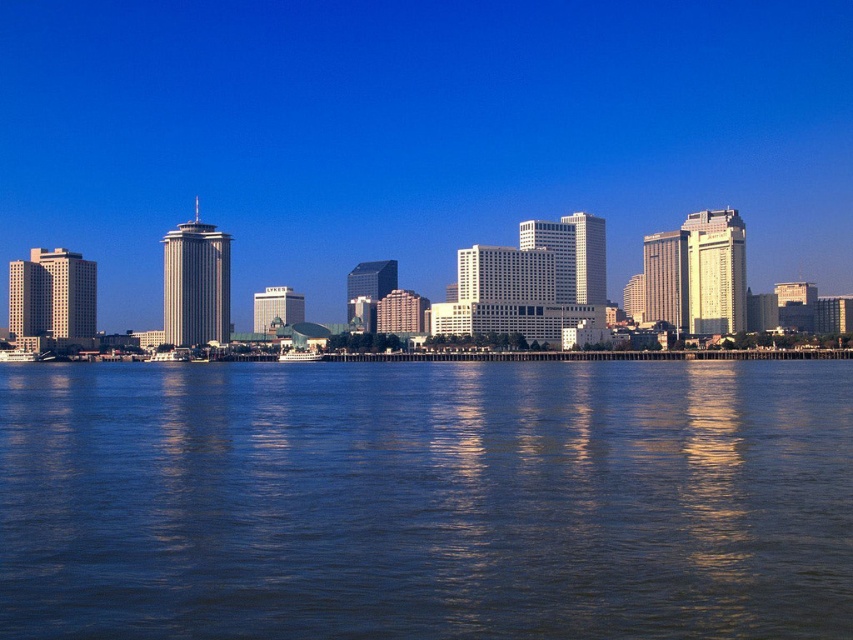
Question: In this image, where is blue liquid water at lower center located relative to transparent glass skyscrapers at center?

Choices:
 (A) above
 (B) below

Answer: (B)

Question: In this image, where is blue liquid water at lower center located relative to transparent glass skyscrapers at center?

Choices:
 (A) below
 (B) above

Answer: (A)

Question: Which point is farther to the camera?

Choices:
 (A) blue liquid water at lower center
 (B) transparent glass skyscrapers at center

Answer: (B)

Question: Can you confirm if blue liquid water at lower center is positioned above transparent glass skyscrapers at center?

Choices:
 (A) no
 (B) yes

Answer: (A)